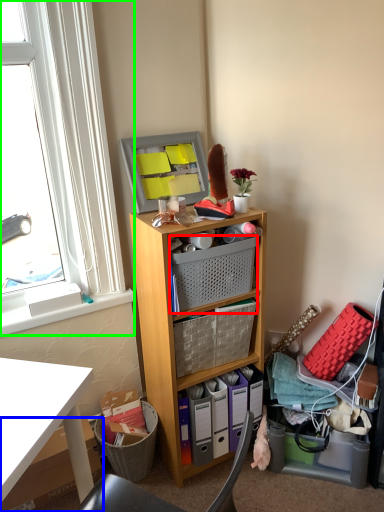
Question: Which object is the closest to the basket (highlighted by a red box)? Choose among these: box (highlighted by a blue box) or window (highlighted by a green box).

Choices:
 (A) box
 (B) window

Answer: (B)